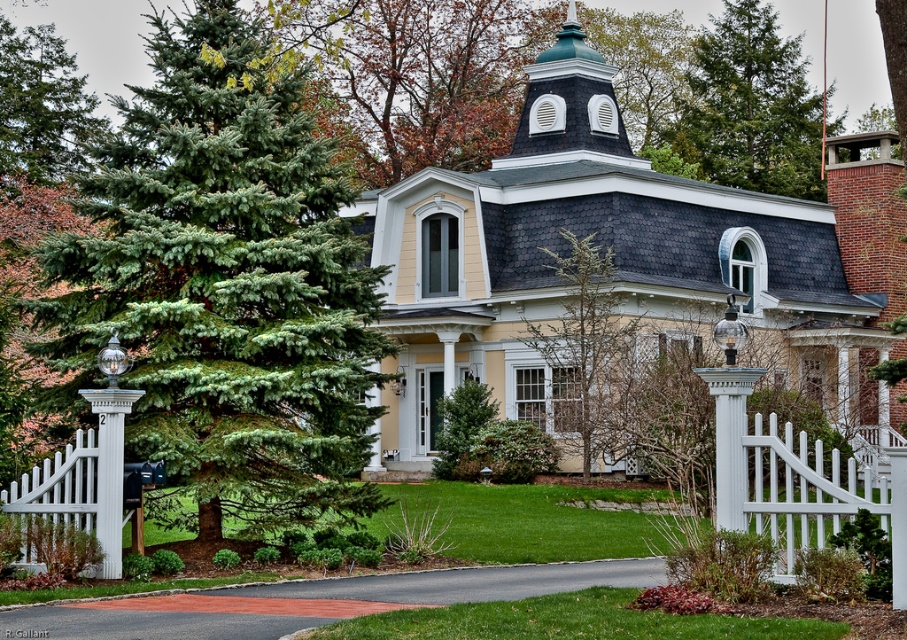
Question: Can you confirm if yellow wood house at center is smaller than bare branches at center?

Choices:
 (A) no
 (B) yes

Answer: (A)

Question: Observing the image, what is the correct spatial positioning of yellow wood house at center in reference to bare branches at center?

Choices:
 (A) above
 (B) below

Answer: (A)

Question: Estimate the real-world distances between objects in this image. Which object is farther from the green evergreen tree at upper center?

Choices:
 (A) bare branches at center
 (B) green fir tree at center
 (C) green needle-like at left
 (D) yellow wood house at center

Answer: (A)

Question: Does green fir tree at center appear on the left side of bare branches at center?

Choices:
 (A) no
 (B) yes

Answer: (B)

Question: Which point is closer to the camera taking this photo?

Choices:
 (A) (798, 154)
 (B) (95, 138)

Answer: (A)

Question: Estimate the real-world distances between objects in this image. Which object is closer to the bare branches at center?

Choices:
 (A) green evergreen tree at upper center
 (B) green fir tree at center
 (C) white painted wood post at center
 (D) green needle-like at left

Answer: (B)